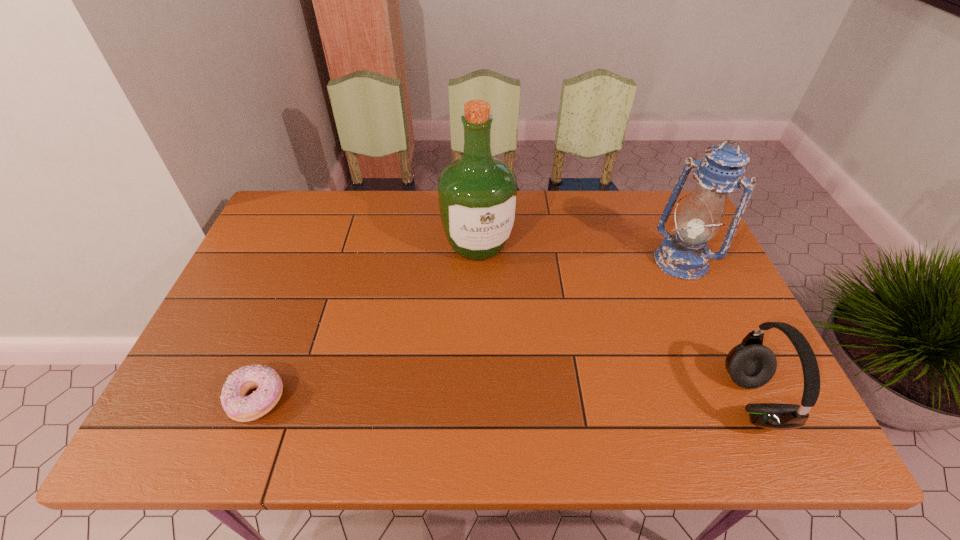
The height and width of the screenshot is (540, 960). I want to click on vacant spot on the desktop that is between the shortest object and the third tallest object and is positioned on the front-facing side of the second object from left to right, so click(x=539, y=400).

What are the coordinates of `vacant spot on the desktop that is between the leftmost object and the headset and is positioned on the front-facing side of the second tallest object` in the screenshot? It's located at (567, 400).